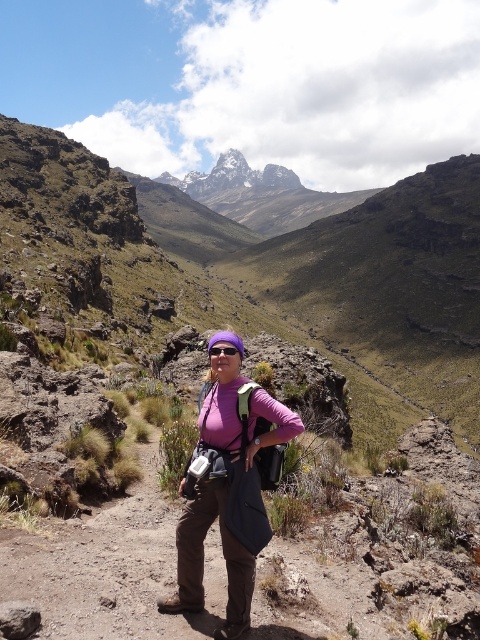
Is pink fabric shirt at center above purple reflective goggles at center?

Incorrect, pink fabric shirt at center is not positioned above purple reflective goggles at center.

Who is taller, pink fabric shirt at center or purple reflective goggles at center?

With more height is pink fabric shirt at center.

Does point (240, 518) lie in front of point (227, 349)?

That is True.

In order to click on pink fabric shirt at center in this screenshot , I will do `click(227, 490)`.

Can you confirm if rugged granite peak at center is taller than purple reflective goggles at center?

Yes.

Between point (264, 172) and point (228, 349), which one is positioned behind?

The point (264, 172) is more distant.

Image resolution: width=480 pixels, height=640 pixels. In order to click on rugged granite peak at center in this screenshot , I will do `click(232, 177)`.

The image size is (480, 640). What do you see at coordinates (227, 490) in the screenshot? I see `pink fabric shirt at center` at bounding box center [227, 490].

Which is in front, point (202, 429) or point (224, 189)?

Positioned in front is point (202, 429).

Between point (236, 408) and point (241, 184), which one is positioned in front?

Positioned in front is point (236, 408).

Locate an element on the screen. This screenshot has height=640, width=480. pink fabric shirt at center is located at coordinates (227, 490).